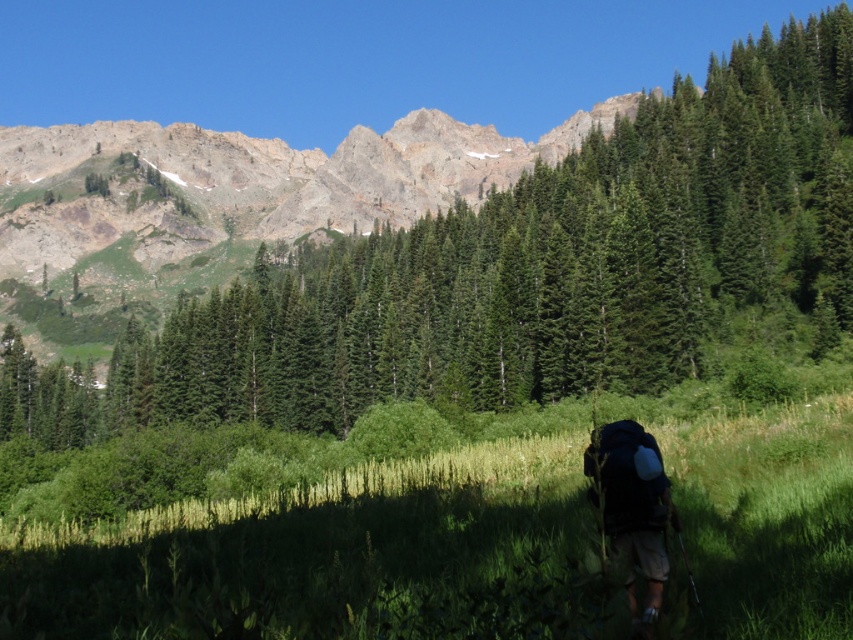
Does green grassy at lower center lie in front of dark blue backpack at lower right?

Yes.

Where is `green grassy at lower center`? The image size is (853, 640). green grassy at lower center is located at coordinates (306, 552).